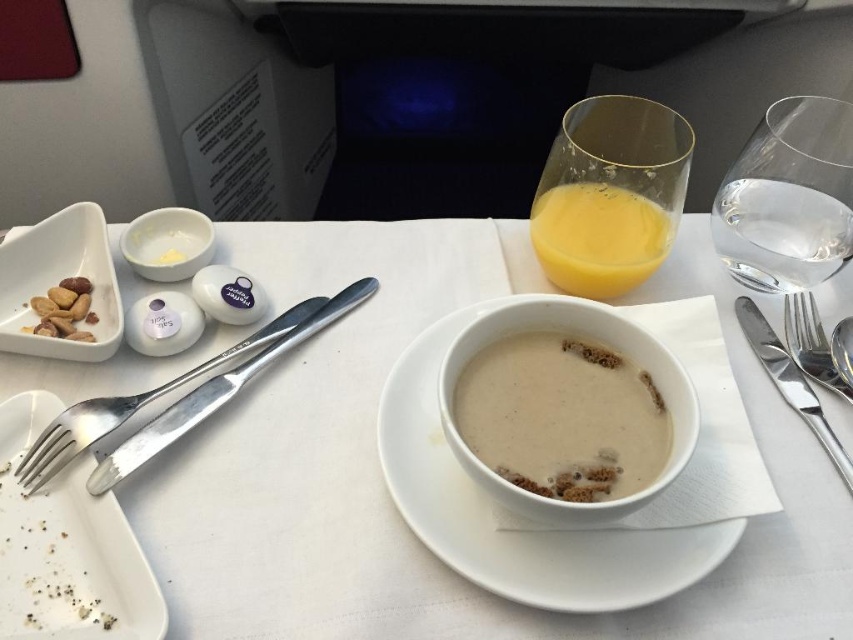
Locate an element on the screen. white creamy soup at center is located at coordinates (561, 417).

The height and width of the screenshot is (640, 853). What do you see at coordinates (561, 417) in the screenshot?
I see `white creamy soup at center` at bounding box center [561, 417].

Between point (526, 374) and point (212, 394), which one is positioned behind?

Positioned behind is point (212, 394).

Find the location of a particular element. Image resolution: width=853 pixels, height=640 pixels. white creamy soup at center is located at coordinates (561, 417).

Can you confirm if satin silver knife at right is thinner than silver metallic knife at upper right?

In fact, satin silver knife at right might be wider than silver metallic knife at upper right.

Is satin silver knife at right to the right of silver metallic knife at upper right from the viewer's perspective?

In fact, satin silver knife at right is to the left of silver metallic knife at upper right.

Does point (793, 392) come farther from viewer compared to point (840, 369)?

No, (793, 392) is closer to viewer.

Find the location of a particular element. The width and height of the screenshot is (853, 640). satin silver knife at right is located at coordinates pos(790,381).

Does white matte plate at center appear over white ceramic plate at center?

Correct, white matte plate at center is located above white ceramic plate at center.

Does point (752, 620) come closer to viewer compared to point (634, 328)?

Yes, point (752, 620) is closer to viewer.

Identify the location of white matte plate at center. (387, 496).

Image resolution: width=853 pixels, height=640 pixels. I want to click on white matte plate at center, so click(x=387, y=496).